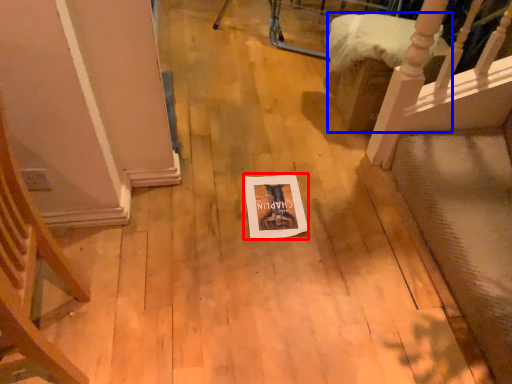
Question: Among these objects, which one is farthest to the camera, postcard (highlighted by a red box) or furniture (highlighted by a blue box)?

Choices:
 (A) postcard
 (B) furniture

Answer: (B)